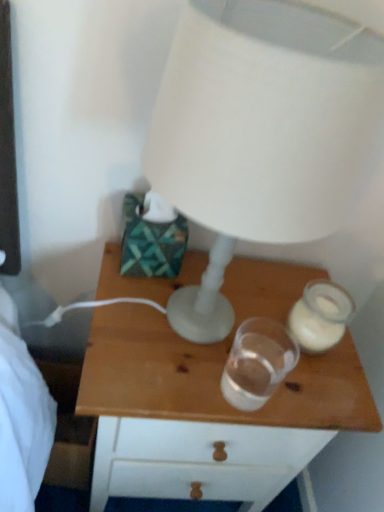
Where is `unoccupied area behind transparent glass at center, positioned as the second candle holder in right-to-left order`? The image size is (384, 512). unoccupied area behind transparent glass at center, positioned as the second candle holder in right-to-left order is located at coordinates (240, 325).